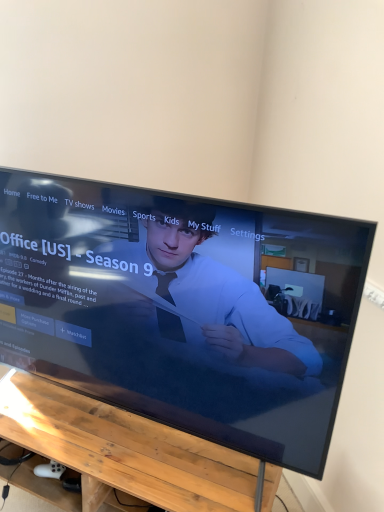
At what (x,y) coordinates should I click in order to perform the action: click on free point above wooden table at lower center (from a real-world perspective). Please return your answer as a coordinate pair (x, y). The height and width of the screenshot is (512, 384). Looking at the image, I should click on (114, 435).